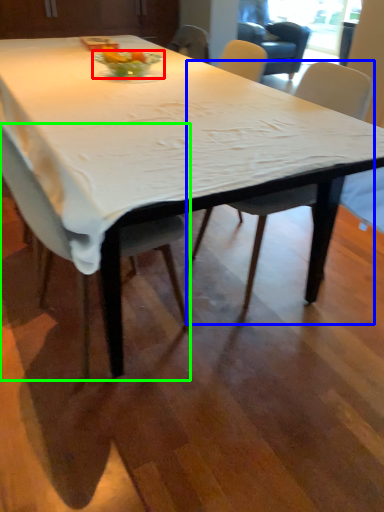
Question: Based on their relative distances, which object is farther from glass bowl (highlighted by a red box)? Choose from chair (highlighted by a blue box) and chair (highlighted by a green box).

Choices:
 (A) chair
 (B) chair

Answer: (B)